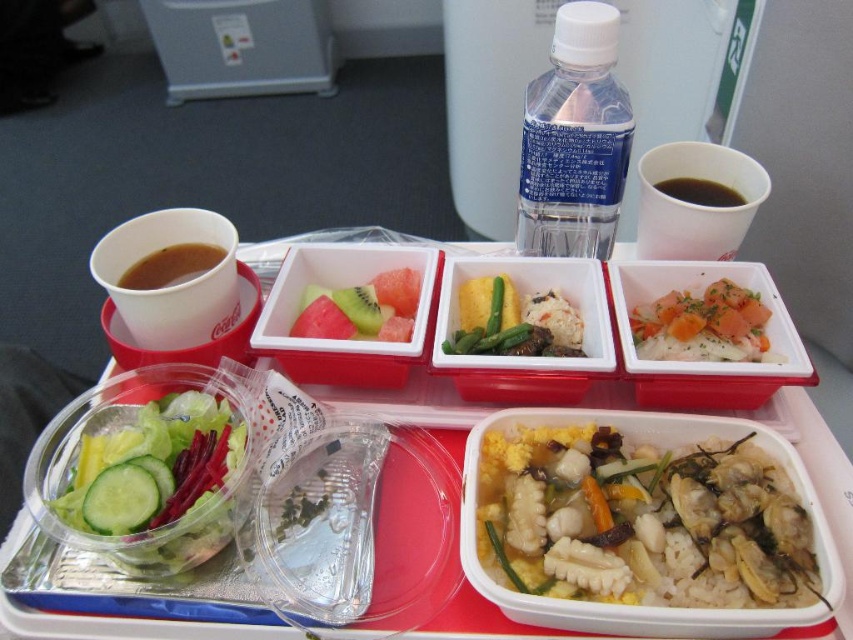
Is yellow rice with seafood at center behind black liquid at upper right?

No.

This screenshot has width=853, height=640. Describe the element at coordinates (642, 520) in the screenshot. I see `yellow rice with seafood at center` at that location.

Which is in front, point (589, 444) or point (729, 202)?

Point (589, 444)

Identify the location of yellow rice with seafood at center. The width and height of the screenshot is (853, 640). (642, 520).

Who is shorter, transparent plastic bottle at upper center or white rice with carrot and herbs at center right?

With less height is white rice with carrot and herbs at center right.

Does point (579, 44) come closer to viewer compared to point (688, 358)?

Yes, it is in front of point (688, 358).

The height and width of the screenshot is (640, 853). Find the location of `transparent plastic bottle at upper center`. transparent plastic bottle at upper center is located at coordinates (573, 140).

Is green translucent salad at lower left below black liquid at upper right?

Correct, green translucent salad at lower left is located below black liquid at upper right.

Describe the element at coordinates (149, 481) in the screenshot. I see `green translucent salad at lower left` at that location.

Find the location of a particular element. green translucent salad at lower left is located at coordinates (149, 481).